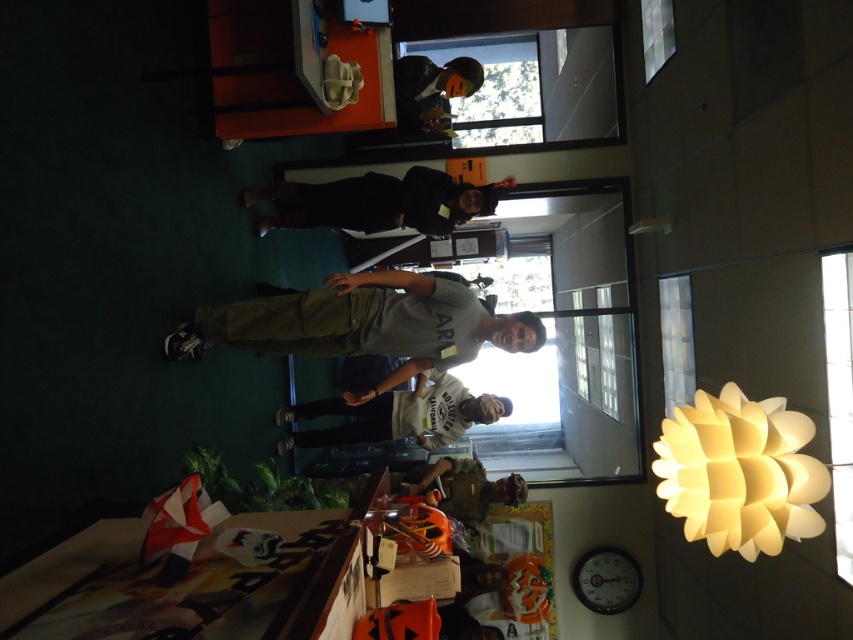
Question: Which point is farther to the camera?

Choices:
 (A) (445, 496)
 (B) (666, 449)

Answer: (A)

Question: Which of the following is the farthest from the observer?

Choices:
 (A) (372, 323)
 (B) (364, 218)
 (C) (434, 67)

Answer: (C)

Question: Is white matte lamp at upper right closer to the viewer compared to matte black jacket at upper center?

Choices:
 (A) yes
 (B) no

Answer: (A)

Question: Can you confirm if matte gray t-shirt at center is wider than white matte lamp at upper right?

Choices:
 (A) no
 (B) yes

Answer: (B)

Question: Is matte gray t-shirt at center positioned behind matte black jacket at upper center?

Choices:
 (A) no
 (B) yes

Answer: (A)

Question: Which object appears farthest from the camera in this image?

Choices:
 (A) camouflage fabric backpack at center
 (B) white matte lamp at upper right
 (C) black matte jacket at center

Answer: (A)